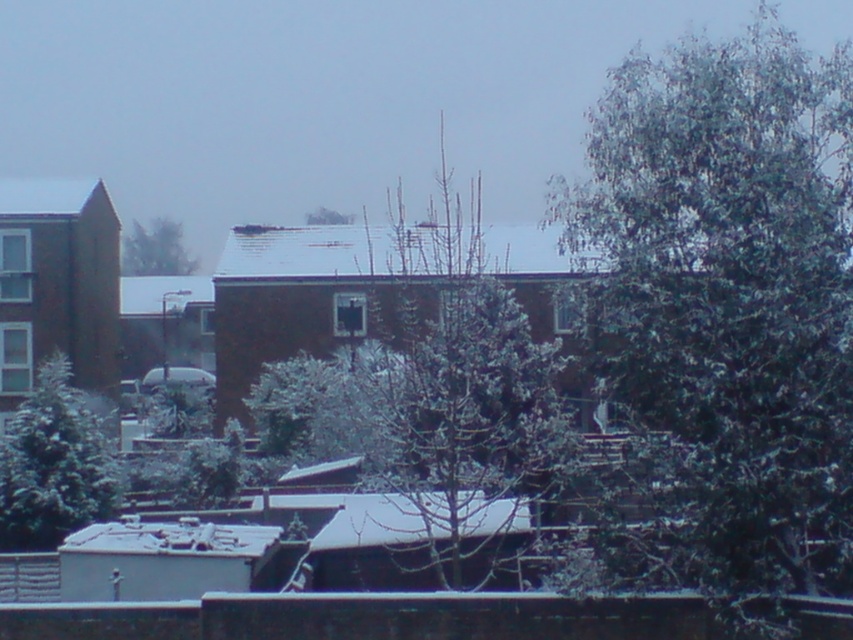
You are standing in the winter scene and want to walk from the snowy evergreen tree at upper left to the green frosted tree at center. Which direction should you head?

You should head to the right towards the green frosted tree at center since the snowy evergreen tree at upper left is located to its left.